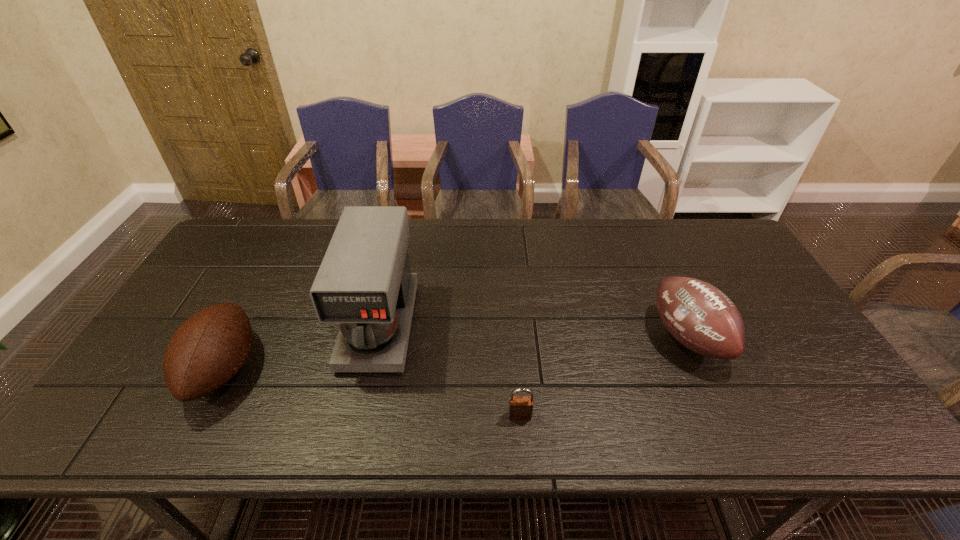
I want to click on free point that satisfies the following two spatial constraints: 1. on the carafe side of the coffee maker; 2. on the laces of the left football, so click(x=370, y=369).

Locate an element on the screen. free space that satisfies the following two spatial constraints: 1. on the front side of the right football; 2. on the laces of the leftmost object is located at coordinates (702, 369).

The width and height of the screenshot is (960, 540). In order to click on free space that satisfies the following two spatial constraints: 1. on the carafe side of the rightmost object; 2. on the left side of the coffee maker in this screenshot , I will do `click(377, 338)`.

Find the location of a particular element. Image resolution: width=960 pixels, height=540 pixels. vacant point that satisfies the following two spatial constraints: 1. on the carafe side of the third object from right to left; 2. on the left side of the rightmost object is located at coordinates (377, 338).

I want to click on vacant position in the image that satisfies the following two spatial constraints: 1. on the carafe side of the rightmost object; 2. on the left side of the tallest object, so click(x=377, y=338).

Where is `vacant space that satisfies the following two spatial constraints: 1. on the carafe side of the third object from right to left; 2. on the left side of the right football`? vacant space that satisfies the following two spatial constraints: 1. on the carafe side of the third object from right to left; 2. on the left side of the right football is located at coordinates (377, 338).

You are a GUI agent. You are given a task and a screenshot of the screen. Output one action in this format:
    pyautogui.click(x=<x>, y=<y>)
    Task: Click on the vacant area in the image that satisfies the following two spatial constraints: 1. on the carafe side of the third object from right to left; 2. on the laces of the leftmost object
    
    Given the screenshot: What is the action you would take?
    pyautogui.click(x=370, y=369)